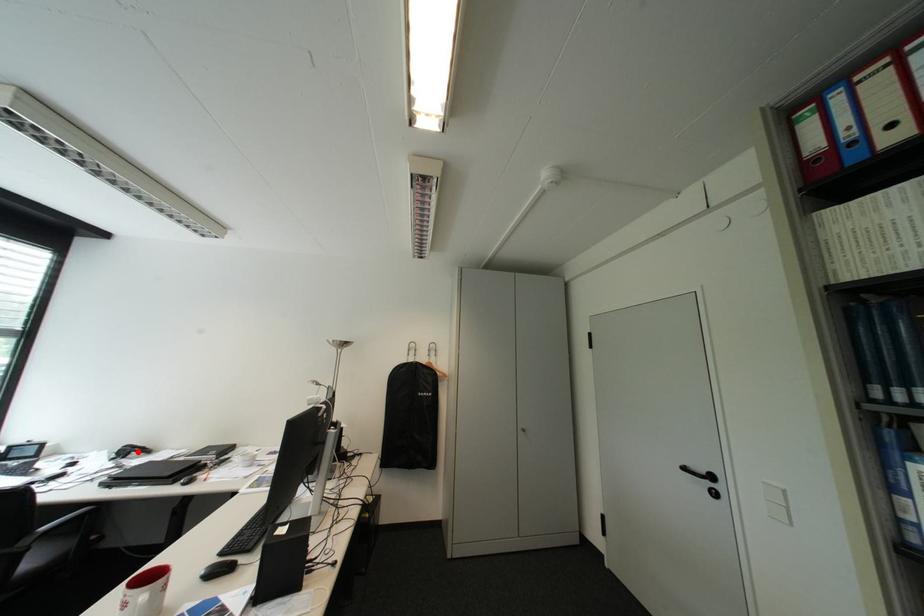
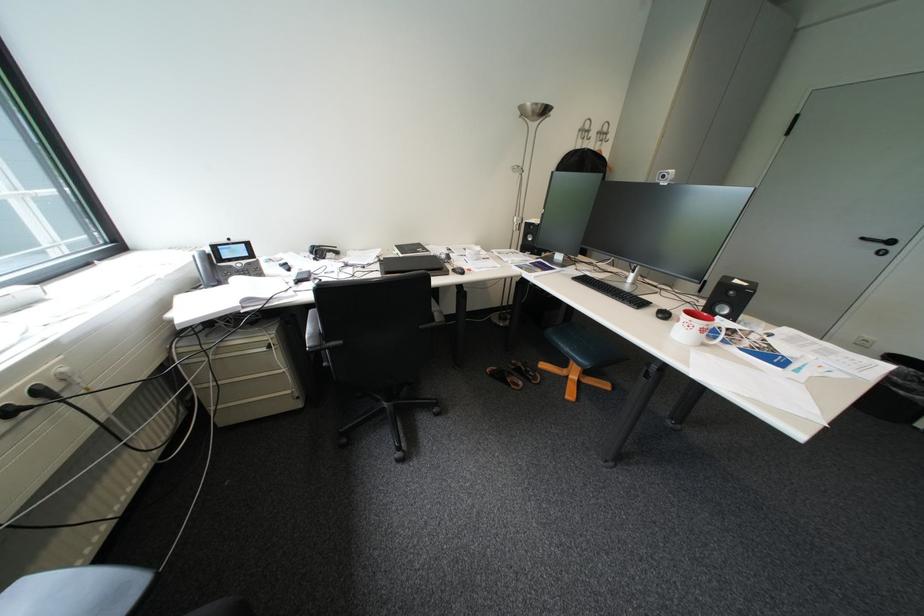
Where in the second image is the point corresponding to the highlighted location from the first image?

(331, 253)